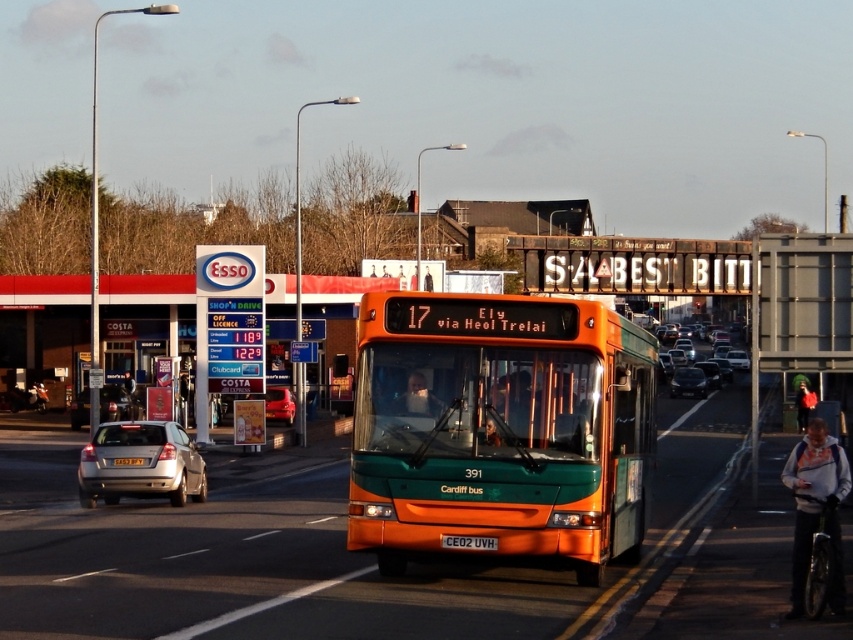
Question: Among these points, which one is farthest from the camera?

Choices:
 (A) (3, 298)
 (B) (486, 547)
 (C) (689, 374)
 (D) (270, 408)

Answer: (C)

Question: Considering the relative positions of metallic orange bus at center and orange metallic license plate at center in the image provided, where is metallic orange bus at center located with respect to orange metallic license plate at center?

Choices:
 (A) right
 (B) left

Answer: (B)

Question: Which point is farther to the camera?

Choices:
 (A) green matte bus at center
 (B) metallic orange bus at center
 (C) orange metallic license plate at center

Answer: (B)

Question: Is orange metallic license plate at center below orange plastic license plate at center?

Choices:
 (A) no
 (B) yes

Answer: (A)

Question: Which object is farther from the camera taking this photo?

Choices:
 (A) metallic silver sedan at center-right
 (B) green matte bus at center
 (C) silver metallic sedan at center-left

Answer: (A)

Question: Can you confirm if metallic orange bus at center is bigger than silver metallic sedan at lower left?

Choices:
 (A) yes
 (B) no

Answer: (A)